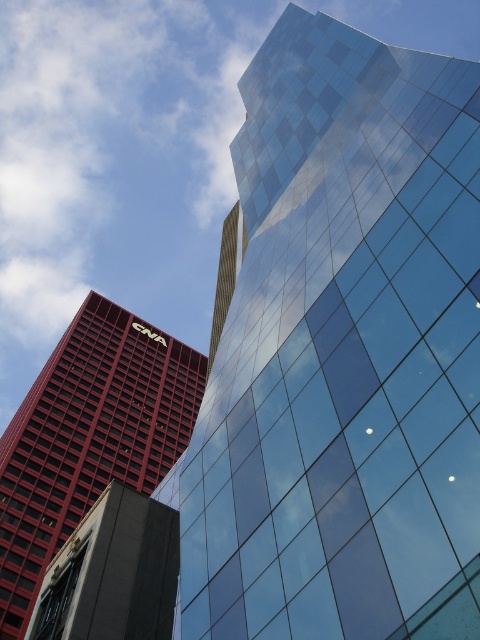
Question: Does red brick building at left have a lesser width compared to gold textured tower at center?

Choices:
 (A) yes
 (B) no

Answer: (B)

Question: Is transparent glass building at upper right further to the viewer compared to gold textured tower at center?

Choices:
 (A) yes
 (B) no

Answer: (B)

Question: Which point is closer to the camera?

Choices:
 (A) (142, 440)
 (B) (206, 372)
 (C) (206, 476)

Answer: (C)

Question: Which point is closer to the camera?

Choices:
 (A) gold textured tower at center
 (B) red brick building at left
 (C) transparent glass building at upper right

Answer: (C)

Question: Can you confirm if transparent glass building at upper right is bigger than red brick building at left?

Choices:
 (A) no
 (B) yes

Answer: (A)

Question: Which of these objects is positioned farthest from the transparent glass building at upper right?

Choices:
 (A) red brick building at left
 (B) gold textured tower at center

Answer: (A)